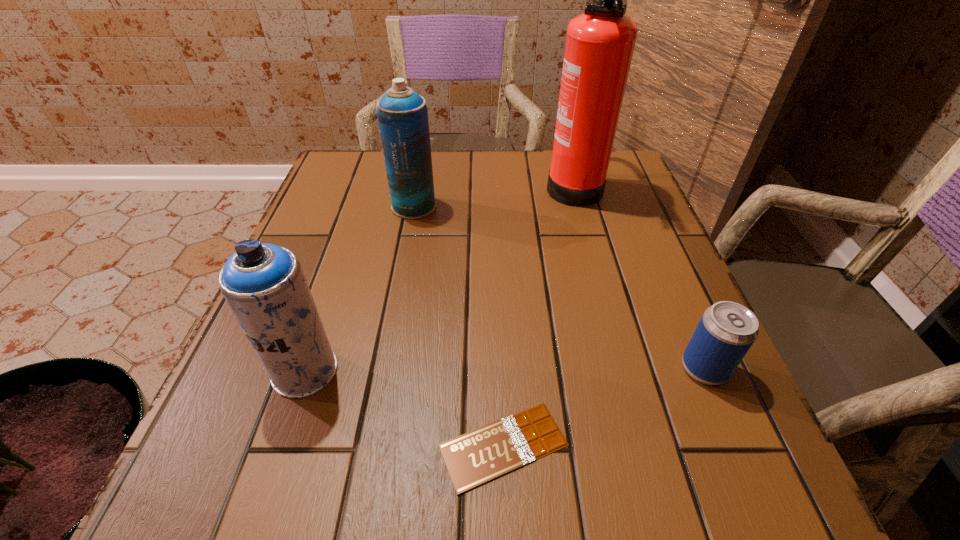
In order to click on object that is at the left edge in this screenshot , I will do `click(264, 284)`.

In order to click on fire extinguisher located in the right edge section of the desktop in this screenshot , I will do `click(600, 42)`.

You are a GUI agent. You are given a task and a screenshot of the screen. Output one action in this format:
    pyautogui.click(x=<x>, y=<y>)
    Task: Click on the beer can that is at the right edge
    This screenshot has width=960, height=540.
    Given the screenshot: What is the action you would take?
    pyautogui.click(x=726, y=331)

I want to click on object located in the far right corner section of the desktop, so click(x=600, y=42).

The height and width of the screenshot is (540, 960). I want to click on blank area at the far edge, so click(x=458, y=179).

Where is `free location at the near edge of the desktop`? This screenshot has width=960, height=540. free location at the near edge of the desktop is located at coordinates (361, 501).

In the image, there is a desktop. Identify the location of vacant area at the left edge. This screenshot has width=960, height=540. (305, 267).

Where is `free region at the right edge of the desktop`? The image size is (960, 540). free region at the right edge of the desktop is located at coordinates (670, 296).

What are the coordinates of `blank space at the near right corner of the desktop` in the screenshot? It's located at (689, 496).

The image size is (960, 540). What are the coordinates of `free space that is in between the tallest object and the chocolate bar` in the screenshot? It's located at (539, 314).